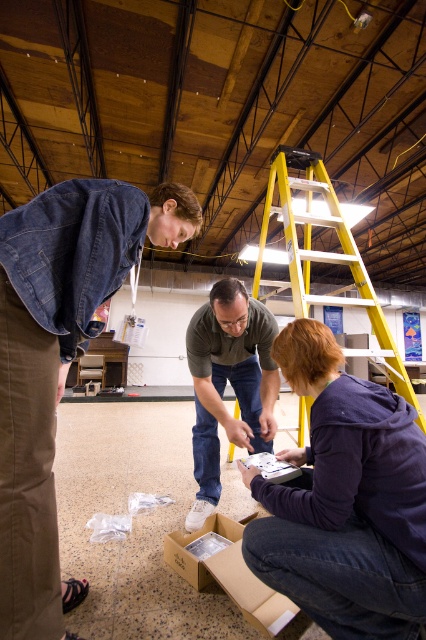
Question: Is purple fleece jacket at lower center thinner than brown cardboard box at lower center?

Choices:
 (A) no
 (B) yes

Answer: (A)

Question: Which point appears farthest from the camera in this image?

Choices:
 (A) (233, 280)
 (B) (66, 310)
 (C) (396, 428)

Answer: (A)

Question: Among these objects, which one is nearest to the camera?

Choices:
 (A) purple fleece jacket at lower center
 (B) brown cardboard box at lower center
 (C) matte gray shirt at center
 (D) denim jacket at lower right

Answer: (A)

Question: Can you confirm if matte gray shirt at center is positioned above brown cardboard box at lower center?

Choices:
 (A) yes
 (B) no

Answer: (A)

Question: Is yellow metallic ladder at upper center above brown cardboard box at lower center?

Choices:
 (A) yes
 (B) no

Answer: (A)

Question: Which object appears farthest from the camera in this image?

Choices:
 (A) purple fleece jacket at lower center
 (B) brown cardboard box at lower center

Answer: (B)